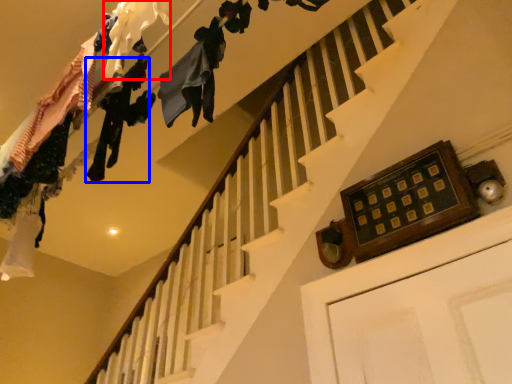
Question: Which object appears closest to the camera in this image, clothing (highlighted by a red box) or clothing (highlighted by a blue box)?

Choices:
 (A) clothing
 (B) clothing

Answer: (A)